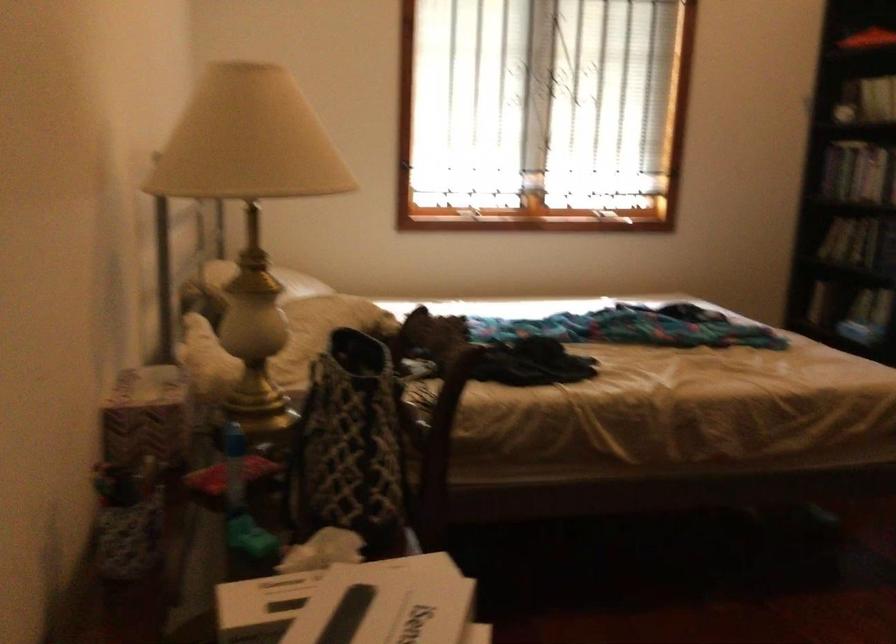
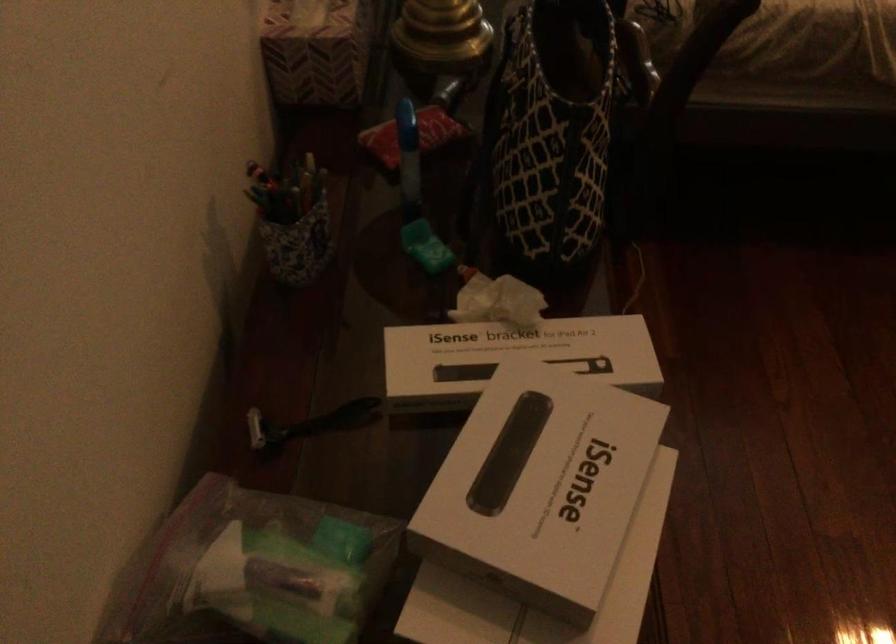
In the second image, find the point that corresponds to (x=149, y=415) in the first image.

(315, 51)